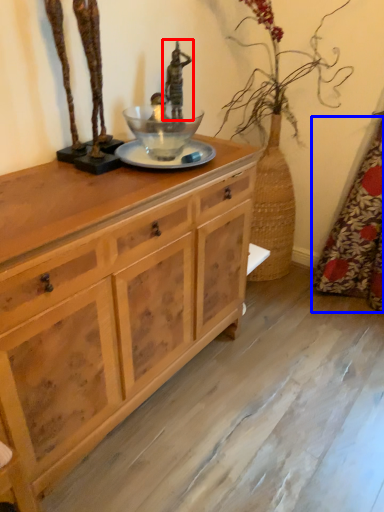
Question: Which object is further to the camera taking this photo, sculpture (highlighted by a red box) or curtain (highlighted by a blue box)?

Choices:
 (A) sculpture
 (B) curtain

Answer: (A)